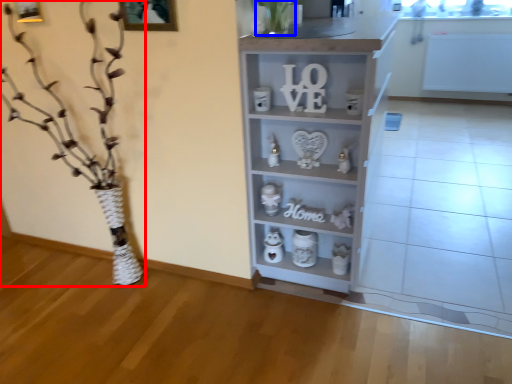
Question: Which point is closer to the camera, floral arrangement (highlighted by a red box) or plant (highlighted by a blue box)?

Choices:
 (A) floral arrangement
 (B) plant

Answer: (A)